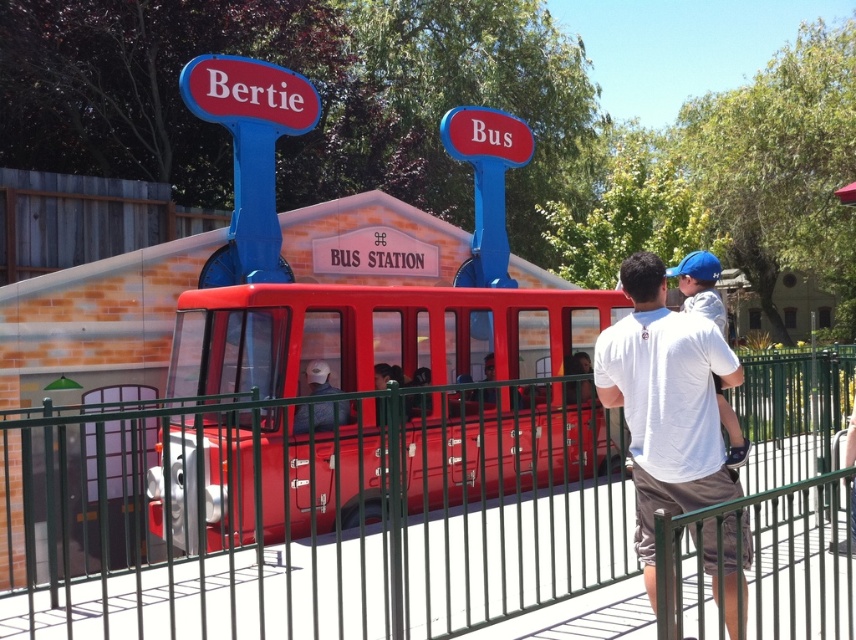
Question: Is green metal fence at center further to the viewer compared to white cotton shirt at center?

Choices:
 (A) no
 (B) yes

Answer: (B)

Question: Which point is farther to the camera?

Choices:
 (A) coord(321,369)
 (B) coord(617,372)
 (C) coord(770,531)
 (D) coord(568,349)

Answer: (D)

Question: Does shiny red train car at center appear on the right side of matte black helmet at center?

Choices:
 (A) yes
 (B) no

Answer: (B)

Question: Which object is farther from the camera taking this photo?

Choices:
 (A) green metal fence at center
 (B) shiny red train car at center
 (C) white cotton shirt at center

Answer: (B)

Question: Can you confirm if green metal fence at center is positioned to the left of matte black helmet at center?

Choices:
 (A) no
 (B) yes

Answer: (A)

Question: Which of these objects is positioned closest to the shiny red train car at center?

Choices:
 (A) white cotton shirt at center
 (B) green metal fence at center
 (C) matte black helmet at center

Answer: (C)